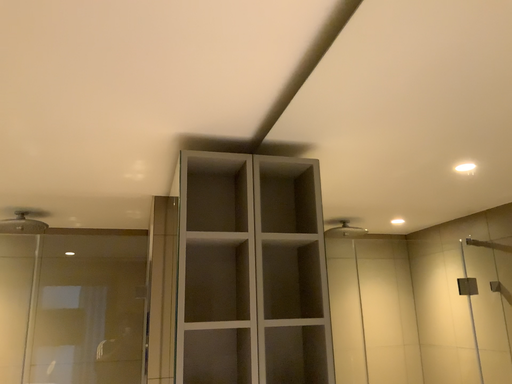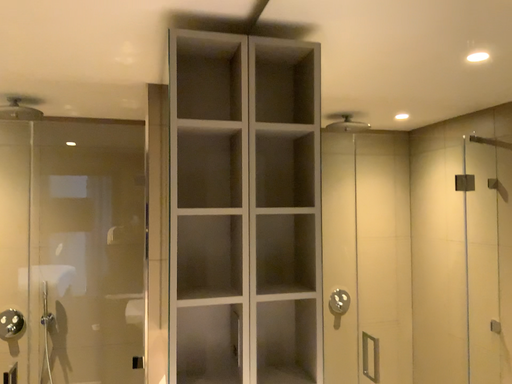
Question: Which way did the camera rotate in the video?

Choices:
 (A) rotated downward
 (B) rotated upward

Answer: (A)